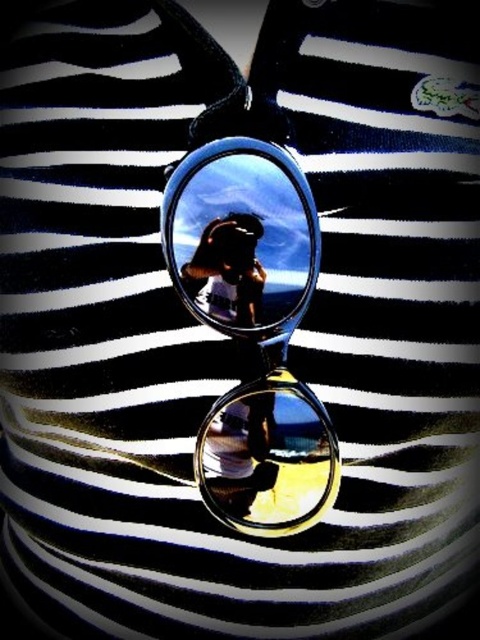
Does clear plastic goggles at center appear on the right side of clear glass lens at center?

In fact, clear plastic goggles at center is to the left of clear glass lens at center.

Between clear plastic goggles at center and clear glass lens at center, which one appears on the left side from the viewer's perspective?

Positioned to the left is clear plastic goggles at center.

Which is behind, point (243, 321) or point (240, 454)?

Point (240, 454)

At what (x,y) coordinates should I click in order to perform the action: click on clear plastic goggles at center. Please return your answer as a coordinate pair (x, y). Looking at the image, I should click on (241, 237).

Based on the photo, is clear glass lens at center below metallic silver phone at center?

Indeed, clear glass lens at center is positioned under metallic silver phone at center.

Is point (262, 516) farther from camera compared to point (219, 280)?

That is True.

Does point (286, 394) lie behind point (245, 262)?

Yes, point (286, 394) is behind point (245, 262).

Where is `clear glass lens at center`? Image resolution: width=480 pixels, height=640 pixels. clear glass lens at center is located at coordinates (267, 458).

Is clear plastic goggles at center taller than metallic silver phone at center?

Yes.

Does point (218, 296) lie behind point (226, 250)?

That is True.

Is point (205, 172) more distant than point (250, 220)?

No, it is in front of (250, 220).

This screenshot has width=480, height=640. I want to click on clear plastic goggles at center, so click(241, 237).